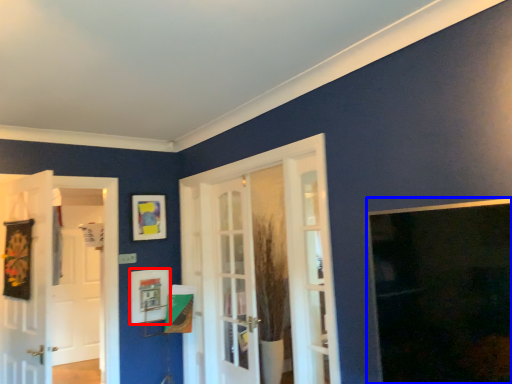
Question: Which object is further to the camera taking this photo, picture frame (highlighted by a red box) or window (highlighted by a blue box)?

Choices:
 (A) picture frame
 (B) window

Answer: (A)